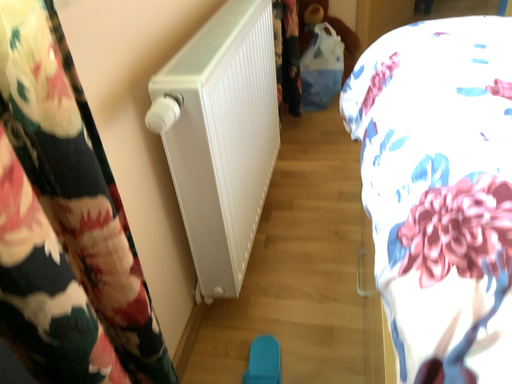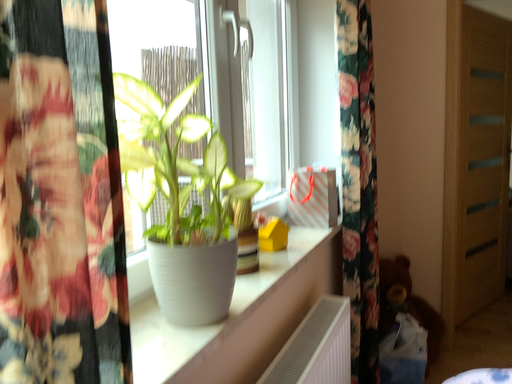
Question: Which way did the camera rotate in the video?

Choices:
 (A) rotated downward
 (B) rotated upward

Answer: (B)